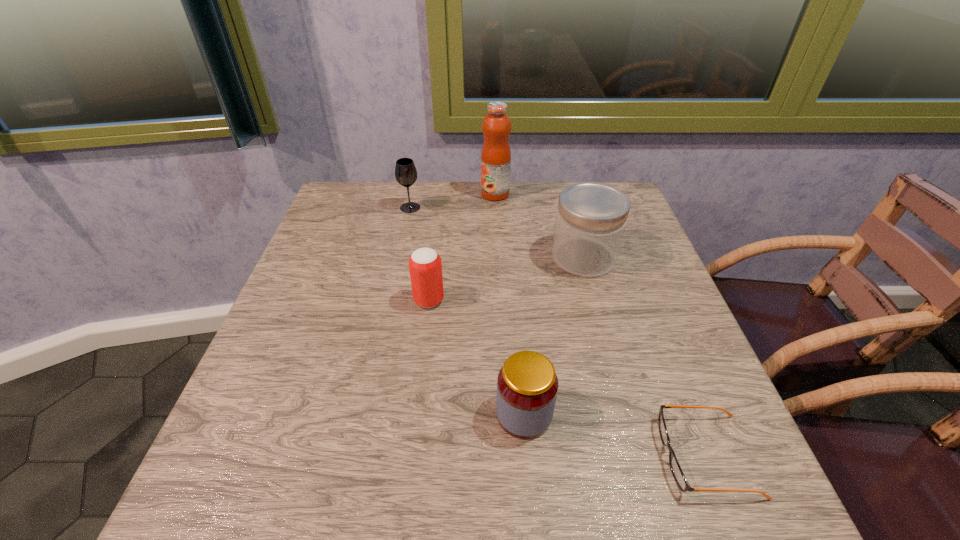
Where is `vacant point located between the taller jar and the nearer jar`? vacant point located between the taller jar and the nearer jar is located at coordinates (554, 336).

Find the location of a particular element. This screenshot has height=540, width=960. blank region between the right jar and the tallest object is located at coordinates (540, 226).

Locate which object is the fourth closest to the nearer jar. Please provide its 2D coordinates. Your answer should be formatted as a tuple, i.e. [(x, y)], where the tuple contains the x and y coordinates of a point satisfying the conditions above.

[(405, 171)]

Where is `the closest object to the left jar`? the closest object to the left jar is located at coordinates (677, 472).

This screenshot has height=540, width=960. In order to click on vacant space that satisfies the following two spatial constraints: 1. on the front side of the fifth nearest object; 2. on the right side of the farther jar in this screenshot , I will do `click(399, 258)`.

Find the location of `free space that satisfies the following two spatial constraints: 1. on the back side of the taller jar; 2. on the front label of the farthest object`. free space that satisfies the following two spatial constraints: 1. on the back side of the taller jar; 2. on the front label of the farthest object is located at coordinates (566, 194).

Where is `vacant point that satisfies the following two spatial constraints: 1. on the front label of the right jar; 2. on the right side of the fruit juice`? vacant point that satisfies the following two spatial constraints: 1. on the front label of the right jar; 2. on the right side of the fruit juice is located at coordinates (498, 258).